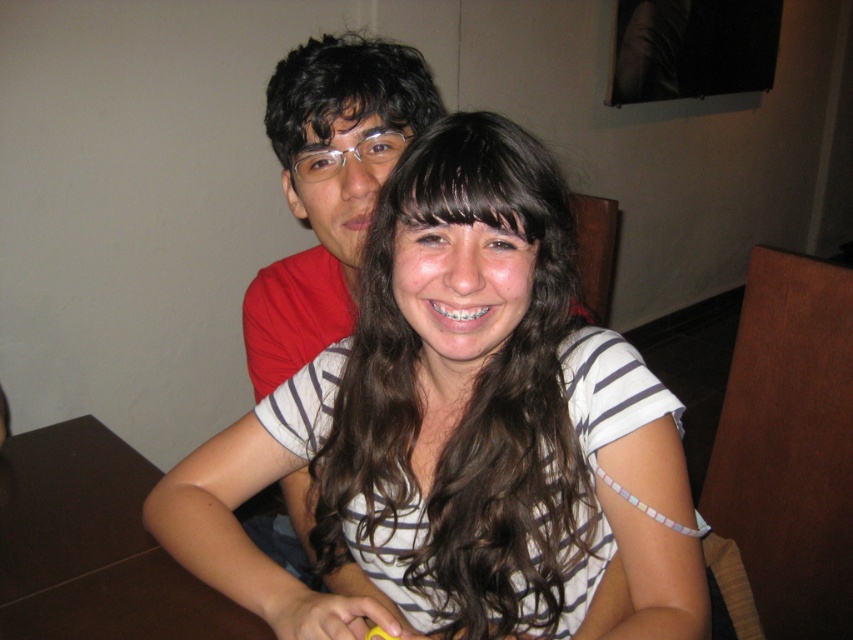
From the picture: Who is lower down, white striped shirt at center or matte red shirt at center?

white striped shirt at center is below.

Does white striped shirt at center appear on the left side of matte red shirt at center?

No, white striped shirt at center is not to the left of matte red shirt at center.

Who is more forward, (474, 157) or (299, 138)?

Point (474, 157) is in front.

Image resolution: width=853 pixels, height=640 pixels. Identify the location of white striped shirt at center. (457, 426).